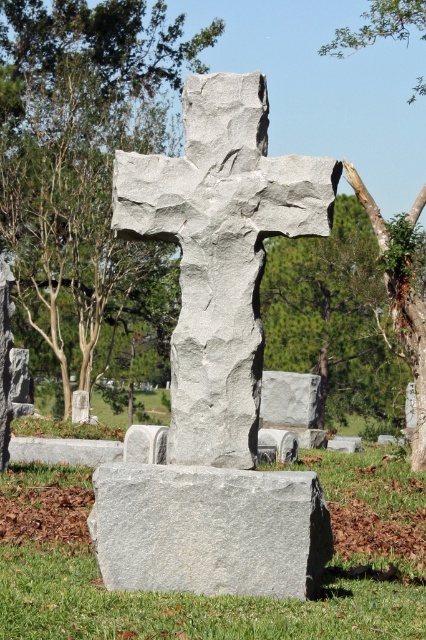
Question: Which object appears closest to the camera in this image?

Choices:
 (A) green leafy tree at center
 (B) brown bark tree trunk at right

Answer: (A)

Question: Which of the following is the farthest from the observer?

Choices:
 (A) click(x=37, y=481)
 (B) click(x=75, y=80)
 (C) click(x=354, y=168)
 (D) click(x=204, y=147)

Answer: (B)

Question: Which point is closer to the camera taking this photo?

Choices:
 (A) (195, 397)
 (B) (270, 257)
 (C) (106, 300)

Answer: (A)

Question: Is the position of green leafy tree at center more distant than that of brown bark tree trunk at right?

Choices:
 (A) no
 (B) yes

Answer: (A)

Question: Is gray stone cross at center below brown bark tree trunk at right?

Choices:
 (A) no
 (B) yes

Answer: (B)

Question: Is gray stone slab at center smaller than gray granite gravestone at lower center?

Choices:
 (A) yes
 (B) no

Answer: (B)